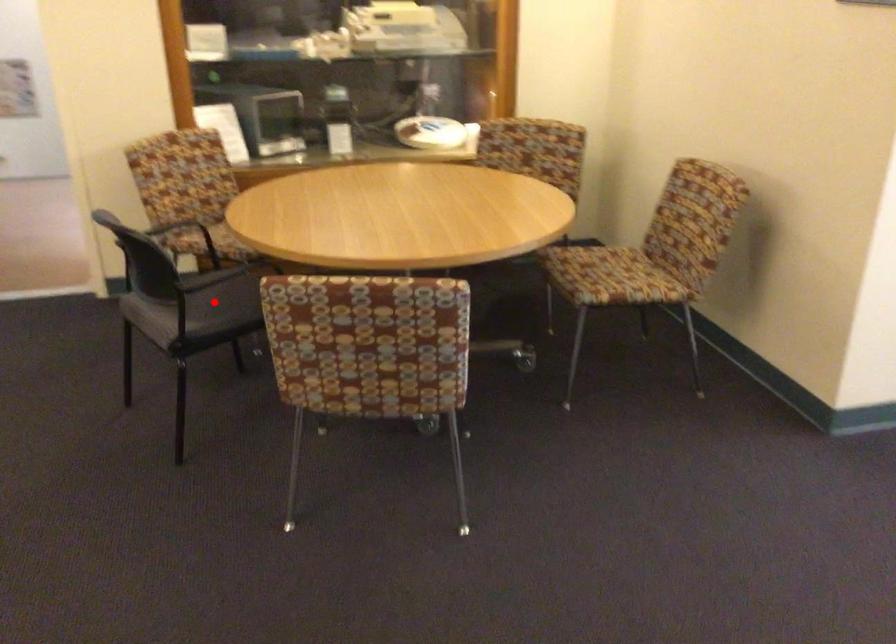
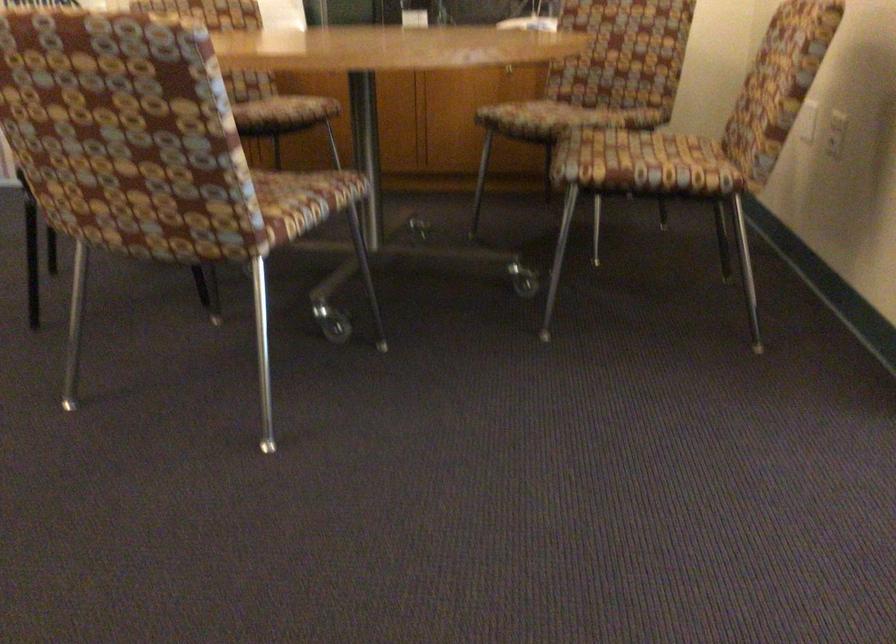
Question: I am providing you with two images of the same scene from different viewpoints. A red point is marked on the first image. Can you still see the location of the red point in image 2?

Choices:
 (A) Yes
 (B) No

Answer: (B)